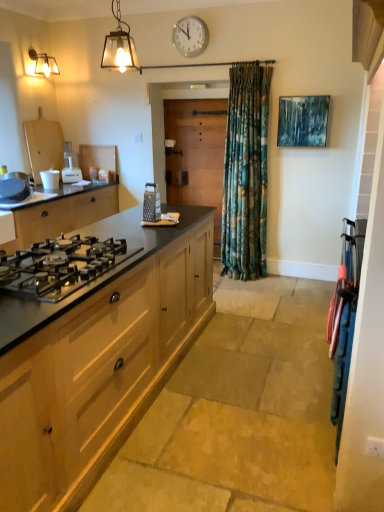
Question: From a real-world perspective, relative to white matte cup at left, which is the 4th appliance in bottom-to-top order, is matte glass lantern at upper left vertically above or below?

Choices:
 (A) below
 (B) above

Answer: (B)

Question: In the image, is matte glass lantern at upper left positioned in front of or behind white matte cup at left, which is the 4th appliance in bottom-to-top order?

Choices:
 (A) front
 (B) behind

Answer: (A)

Question: Which of these objects is positioned closest to the white plastic appliance at center-left, the 5th appliance positioned from the bottom?

Choices:
 (A) matte black frying pan at left, the third appliance when ordered from bottom to top
 (B) polished stainless steel gas stove at lower left
 (C) wooden screen door at center
 (D) white plastic clock at upper center
 (E) silver metallic grater at center, arranged as the second appliance when viewed from the front

Answer: (A)

Question: Which object is positioned closest to the wooden screen door at center?

Choices:
 (A) white plastic appliance at center-left, the third appliance from the right
 (B) white plastic clock at upper center
 (C) white matte cup at left, which ranks as the 2th appliance in top-to-bottom order
 (D) light wood/texture cabinet at left, which is counted as the 1th cabinetry, starting from the front
 (E) blue metallic suitcase at right, the fifth appliance positioned from the top

Answer: (B)